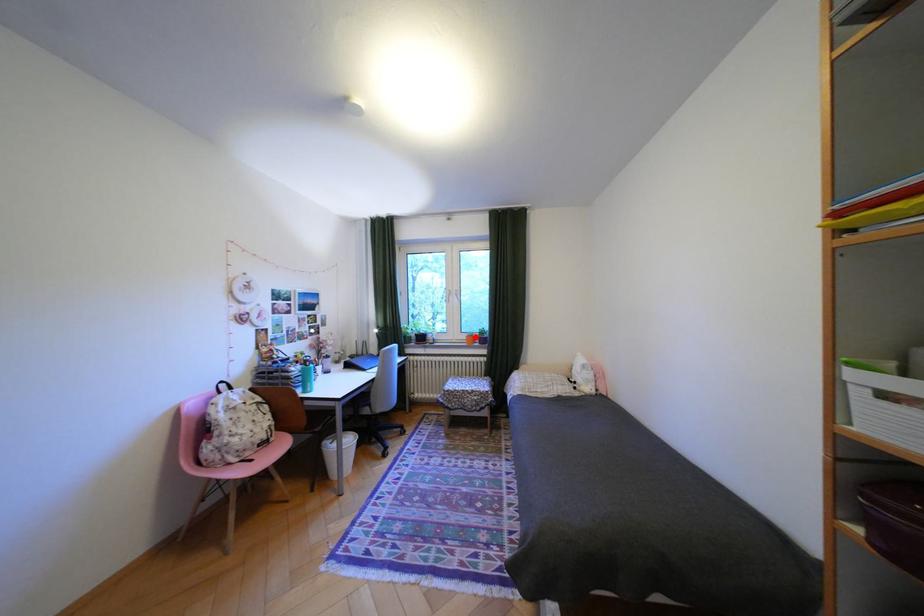
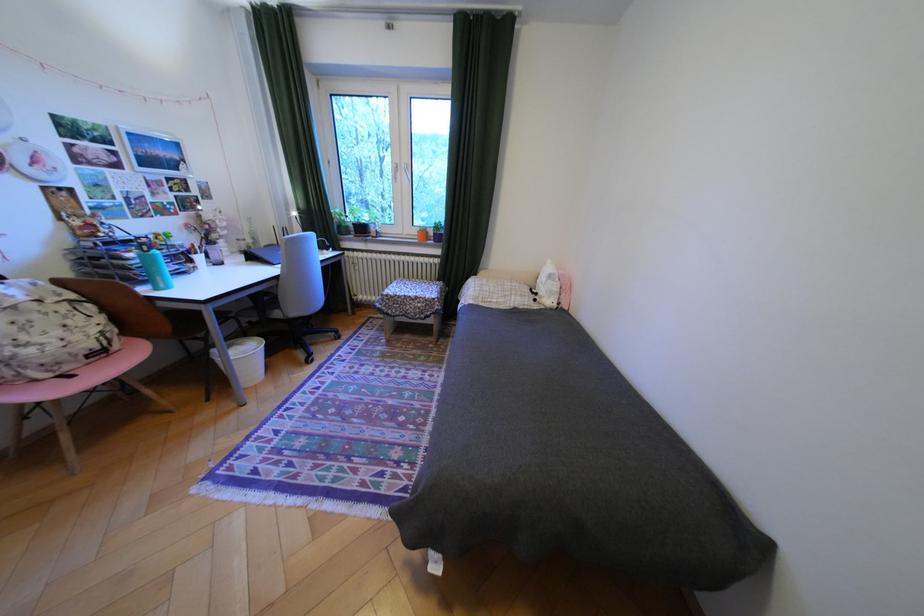
Question: A red point is marked in image1. In image2, is the corresponding 3D point closer to the camera or farther? Reply with the corresponding letter.

Choices:
 (A) The corresponding 3D point is closer.
 (B) The corresponding 3D point is farther.

Answer: (A)